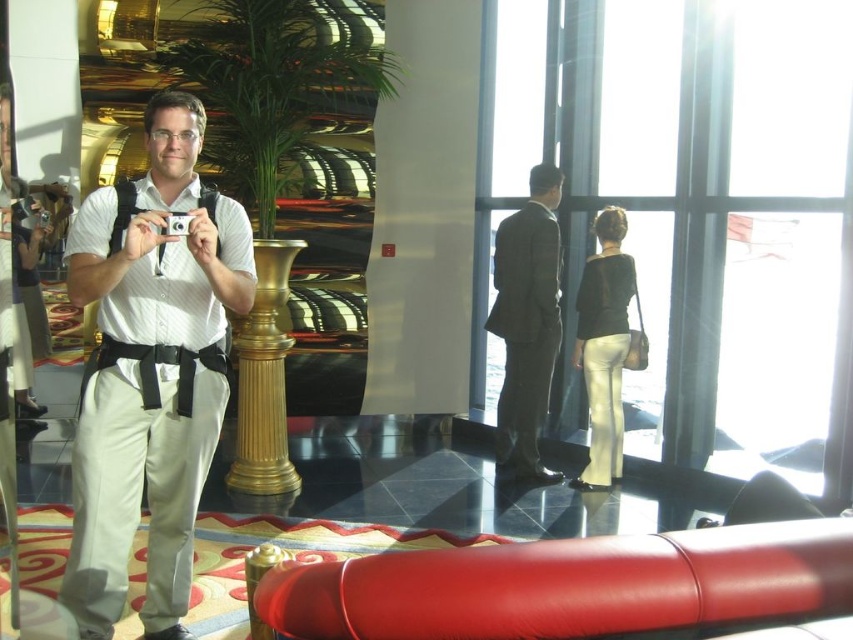
Is white cotton shirt at center smaller than dark gray suit at center?

Actually, white cotton shirt at center might be larger than dark gray suit at center.

Does point (143, 289) come in front of point (550, 336)?

Yes, point (143, 289) is closer to viewer.

You are a GUI agent. You are given a task and a screenshot of the screen. Output one action in this format:
    pyautogui.click(x=<x>, y=<y>)
    Task: Click on the white cotton shirt at center
    The width and height of the screenshot is (853, 640).
    Given the screenshot: What is the action you would take?
    pyautogui.click(x=151, y=369)